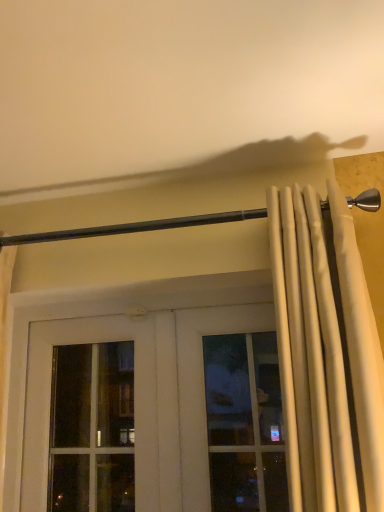
Describe the element at coordinates (134, 227) in the screenshot. The width and height of the screenshot is (384, 512). I see `black metal rod at upper center` at that location.

In order to face black metal rod at upper center, should I rotate leftwards or rightwards?

You should look left and rotate roughly 8.893 degrees.

The width and height of the screenshot is (384, 512). What are the coordinates of `black metal rod at upper center` in the screenshot? It's located at (134, 227).

Measure the distance between black metal rod at upper center and camera.

The distance of black metal rod at upper center from camera is 1.04 meters.

Identify the location of white fabric curtain at right. The width and height of the screenshot is (384, 512). (310, 357).

Describe the element at coordinates (310, 357) in the screenshot. I see `white fabric curtain at right` at that location.

Find the location of a particular element. This screenshot has height=512, width=384. black metal rod at upper center is located at coordinates (134, 227).

Considering the relative positions of white fabric curtain at right and black metal rod at upper center in the image provided, is white fabric curtain at right to the left or to the right of black metal rod at upper center?

From the image, it's evident that white fabric curtain at right is to the right of black metal rod at upper center.

Which object is further away from the camera, white fabric curtain at right or black metal rod at upper center?

black metal rod at upper center is further away from the camera.

Which is closer to the camera, (344,206) or (367,205)?

Point (344,206) is closer to the camera than point (367,205).

From the image's perspective, relative to black metal rod at upper center, is white fabric curtain at right above or below?

From the image's perspective, white fabric curtain at right appears below black metal rod at upper center.

From a real-world perspective, which object stands above the other?

black metal rod at upper center, from a real-world perspective.

Which object is thinner, white fabric curtain at right or black metal rod at upper center?

black metal rod at upper center is thinner.

Between white fabric curtain at right and black metal rod at upper center, which one has more height?

Standing taller between the two is white fabric curtain at right.

Consider the image. In terms of size, does white fabric curtain at right appear bigger or smaller than black metal rod at upper center?

In the image, white fabric curtain at right appears to be larger than black metal rod at upper center.

Can we say white fabric curtain at right lies outside black metal rod at upper center?

Yes, white fabric curtain at right is located beyond the bounds of black metal rod at upper center.

Is white fabric curtain at right far away from black metal rod at upper center?

white fabric curtain at right is actually quite close to black metal rod at upper center.

Is white fabric curtain at right positioned with its back to black metal rod at upper center?

white fabric curtain at right is not turned away from black metal rod at upper center.

How many degrees apart are the facing directions of white fabric curtain at right and black metal rod at upper center?

The angle between the facing direction of white fabric curtain at right and the facing direction of black metal rod at upper center is 0.0395 degrees.

Where is `beam that is above the white fabric curtain at right (from the image's perspective)`? Image resolution: width=384 pixels, height=512 pixels. beam that is above the white fabric curtain at right (from the image's perspective) is located at coordinates (134, 227).

Looking at this image, which object is positioned more to the left, black metal rod at upper center or white fabric curtain at right?

black metal rod at upper center.

Is black metal rod at upper center closer to camera compared to white fabric curtain at right?

No.

Which is in front, point (17, 245) or point (355, 266)?

The point (355, 266) is in front.

From the image's perspective, which is below, black metal rod at upper center or white fabric curtain at right?

white fabric curtain at right appears lower in the image.

Looking at this image, from a real-world perspective, is black metal rod at upper center above or below white fabric curtain at right?

From a real-world perspective, black metal rod at upper center is physically above white fabric curtain at right.

Between black metal rod at upper center and white fabric curtain at right, which one has smaller width?

black metal rod at upper center is thinner.

Based on the photo, which of these two, black metal rod at upper center or white fabric curtain at right, stands taller?

With more height is white fabric curtain at right.

Is black metal rod at upper center smaller than white fabric curtain at right?

Yes, black metal rod at upper center is smaller than white fabric curtain at right.

Would you say white fabric curtain at right is part of black metal rod at upper center's contents?

No, white fabric curtain at right is not surrounded by black metal rod at upper center.

Are black metal rod at upper center and white fabric curtain at right making contact?

No, black metal rod at upper center is not in contact with white fabric curtain at right.

From the picture: Is black metal rod at upper center oriented towards white fabric curtain at right?

No, black metal rod at upper center is not oriented towards white fabric curtain at right.

Locate an element on the screen. beam that is above the white fabric curtain at right (from a real-world perspective) is located at coordinates (134, 227).

Where is `beam on the left of white fabric curtain at right`? beam on the left of white fabric curtain at right is located at coordinates (134, 227).

The height and width of the screenshot is (512, 384). In the image, there is a black metal rod at upper center. Find the location of `curtain below it (from a real-world perspective)`. curtain below it (from a real-world perspective) is located at coordinates (310, 357).